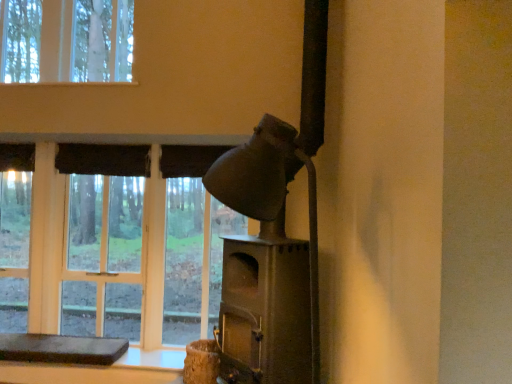
Question: Is brown leather cushion at lower left not within matte glass window at center?

Choices:
 (A) no
 (B) yes

Answer: (B)

Question: Is brown leather cushion at lower left wider than matte glass window at center?

Choices:
 (A) no
 (B) yes

Answer: (B)

Question: Is there a large distance between brown leather cushion at lower left and matte glass window at center?

Choices:
 (A) yes
 (B) no

Answer: (B)

Question: Is brown leather cushion at lower left closer to camera compared to matte glass window at center?

Choices:
 (A) yes
 (B) no

Answer: (A)

Question: From the image's perspective, is brown leather cushion at lower left under matte glass window at center?

Choices:
 (A) yes
 (B) no

Answer: (A)

Question: In terms of width, does matte glass window at center look wider or thinner when compared to matte gray fireplace at center-right?

Choices:
 (A) wide
 (B) thin

Answer: (B)

Question: Based on their sizes in the image, would you say matte glass window at center is bigger or smaller than matte gray fireplace at center-right?

Choices:
 (A) small
 (B) big

Answer: (A)

Question: From a real-world perspective, is matte glass window at center physically located above or below matte gray fireplace at center-right?

Choices:
 (A) above
 (B) below

Answer: (B)

Question: Considering the relative positions of matte glass window at center and matte gray fireplace at center-right in the image provided, is matte glass window at center to the left or to the right of matte gray fireplace at center-right?

Choices:
 (A) right
 (B) left

Answer: (B)

Question: Does point (245, 150) appear closer or farther from the camera than point (206, 238)?

Choices:
 (A) farther
 (B) closer

Answer: (B)

Question: From a real-world perspective, is matte gray fireplace at center-right physically located above or below matte glass window at center?

Choices:
 (A) below
 (B) above

Answer: (B)

Question: From the image's perspective, relative to matte glass window at center, is matte gray fireplace at center-right above or below?

Choices:
 (A) below
 (B) above

Answer: (B)

Question: Would you say matte gray fireplace at center-right is inside or outside matte glass window at center?

Choices:
 (A) outside
 (B) inside

Answer: (A)

Question: From a real-world perspective, relative to matte gray fireplace at center-right, is brown leather cushion at lower left vertically above or below?

Choices:
 (A) above
 (B) below

Answer: (B)

Question: Is brown leather cushion at lower left taller or shorter than matte gray fireplace at center-right?

Choices:
 (A) tall
 (B) short

Answer: (B)